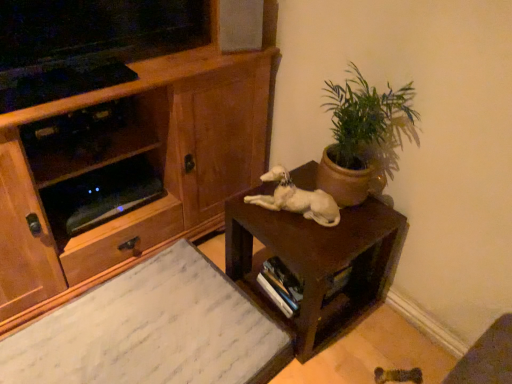
Identify the location of vacant area in front of green matte plant at upper right. (326, 241).